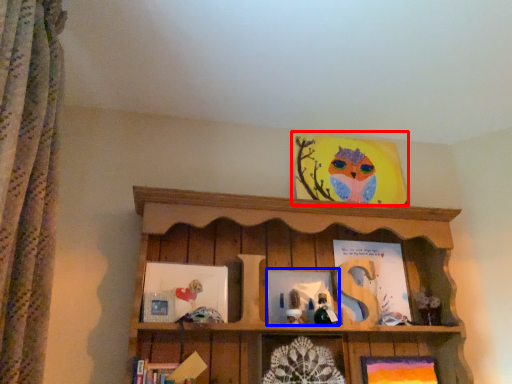
Question: Which of the following is the closest to the observer, picture frame (highlighted by a red box) or picture frame (highlighted by a blue box)?

Choices:
 (A) picture frame
 (B) picture frame

Answer: (B)